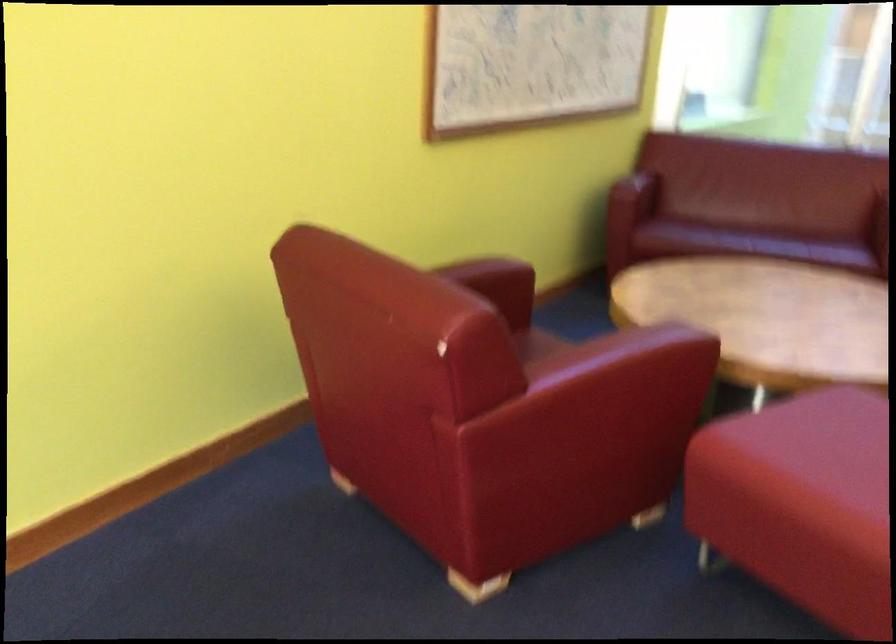
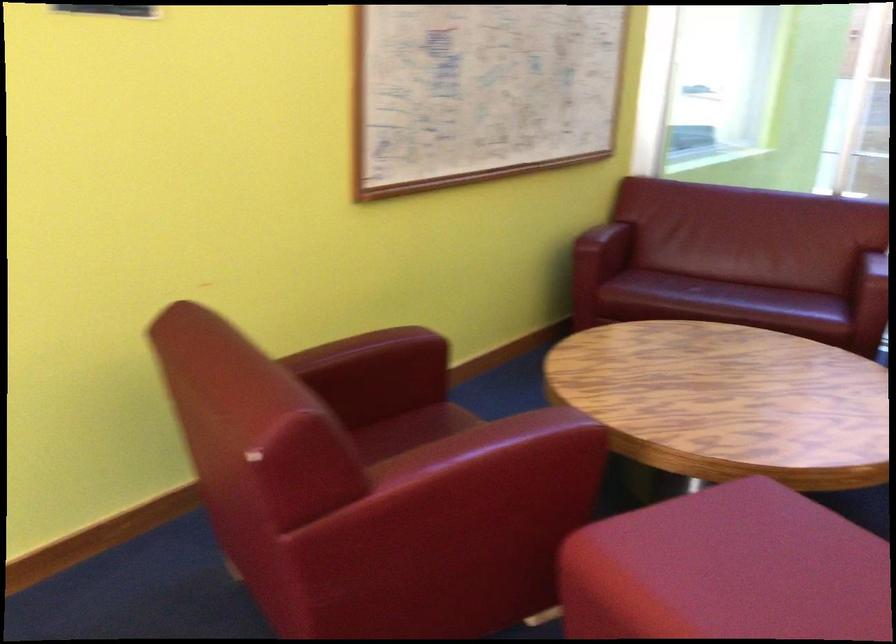
Question: Which direction would the cameraman need to move to produce the second image? Reply with the corresponding letter.

Choices:
 (A) Left
 (B) Right
 (C) Forward
 (D) Backward

Answer: (B)